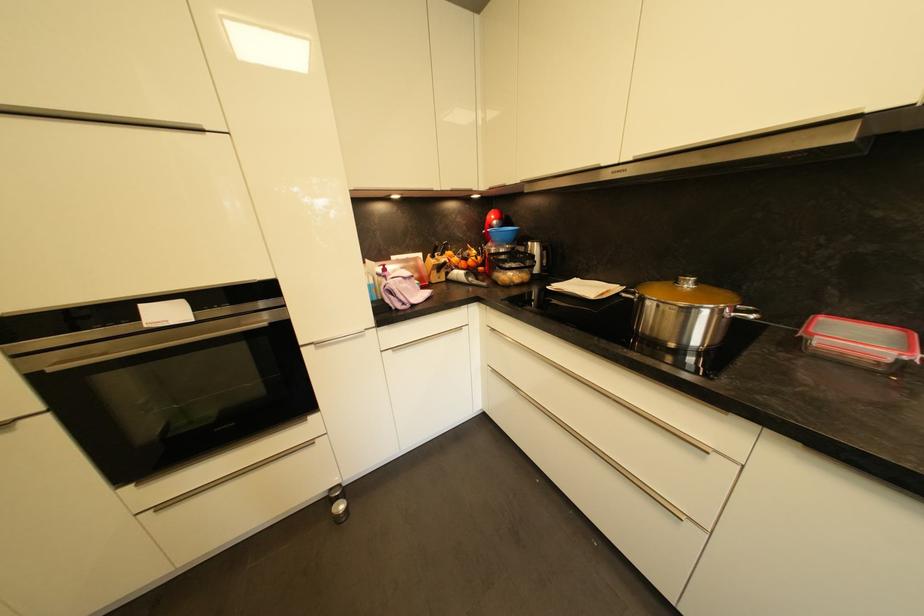
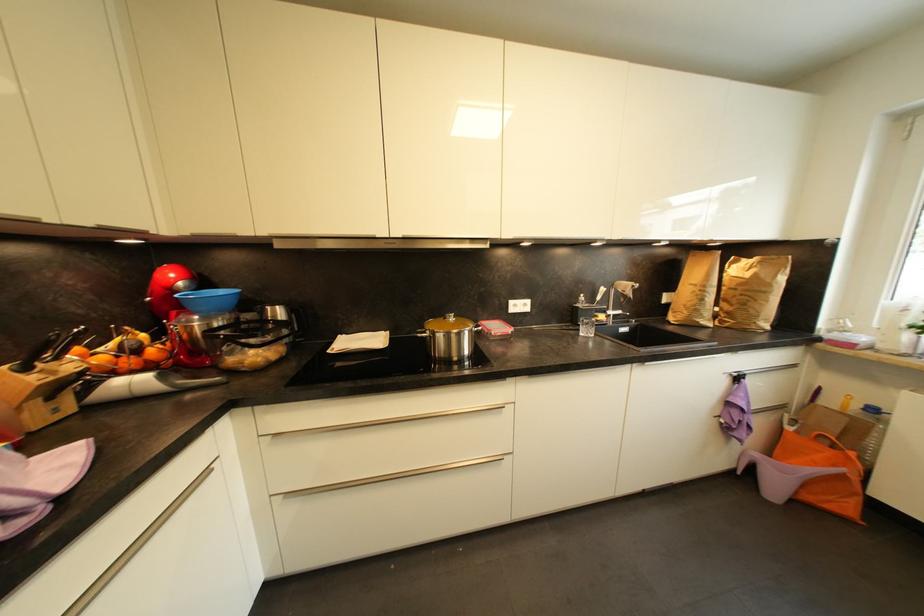
Question: The camera is either moving clockwise (left) or counter-clockwise (right) around the object. The first image is from the beginning of the video and the second image is from the end. Is the camera moving left or right when shooting the video?

Choices:
 (A) Left
 (B) Right

Answer: (A)